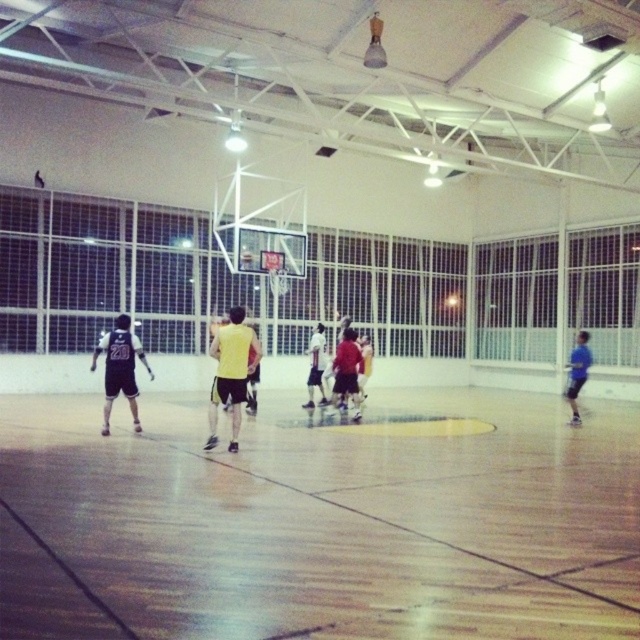
You are a referee observing the game. You notice two players, the matte red jersey at center and the blue matte shirt at right. Which player is shorter?

The matte red jersey at center is shorter than the blue matte shirt at right.

You are a photographer positioned at the entrance of the basketball court. You want to take a photo of the matte red jersey at center. Where should you aim your camera to capture it?

The matte red jersey at center is located at the coordinates point (348,371), so you should aim your camera at that specific point to capture it.

You are a basketball coach observing the court. You notice two points marked on the floor at coordinates point (227, 516) and point (234, 321). Which point is closer to the basketball hoop located at the center of the court?

Point (227, 516) is in front of point (234, 321), so it is closer to the basketball hoop located at the center of the court.